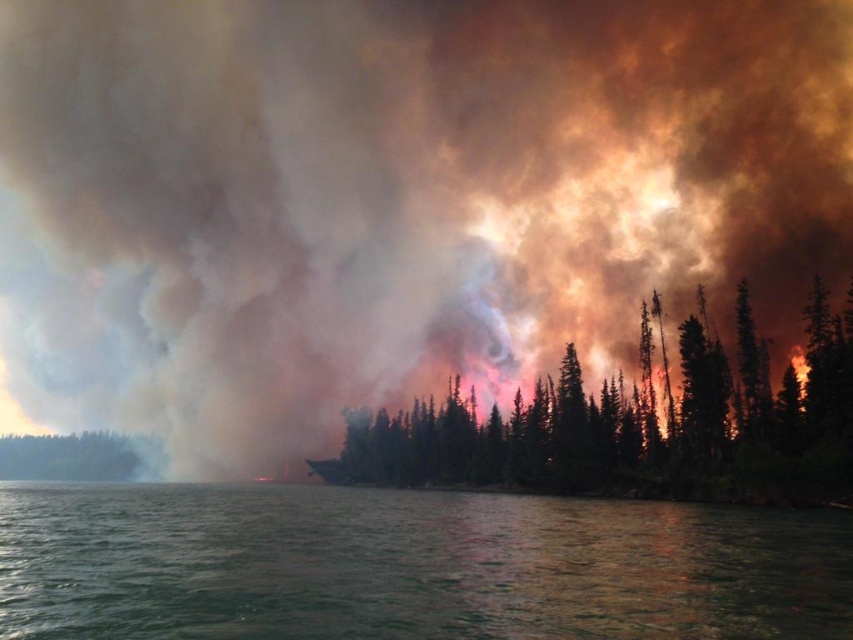
Which is above, green leafy trees at center or green matte tree at left?

green leafy trees at center is above.

Can you confirm if green leafy trees at center is positioned to the left of green matte tree at left?

In fact, green leafy trees at center is to the right of green matte tree at left.

You are a GUI agent. You are given a task and a screenshot of the screen. Output one action in this format:
    pyautogui.click(x=<x>, y=<y>)
    Task: Click on the green leafy trees at center
    The height and width of the screenshot is (640, 853).
    Given the screenshot: What is the action you would take?
    pyautogui.click(x=637, y=428)

At what (x,y) coordinates should I click in order to perform the action: click on green leafy trees at center. Please return your answer as a coordinate pair (x, y). This screenshot has height=640, width=853. Looking at the image, I should click on (637, 428).

Image resolution: width=853 pixels, height=640 pixels. I want to click on green water at lower center, so click(x=409, y=564).

Is green water at lower center above green leafy trees at center?

Indeed, green water at lower center is positioned over green leafy trees at center.

Where is `green water at lower center`? The image size is (853, 640). green water at lower center is located at coordinates (409, 564).

Identify the location of green water at lower center. The image size is (853, 640). [x=409, y=564].

Can you confirm if green water at lower center is thinner than green matte tree at left?

In fact, green water at lower center might be wider than green matte tree at left.

Is green water at lower center to the right of green matte tree at left from the viewer's perspective?

Correct, you'll find green water at lower center to the right of green matte tree at left.

Between point (508, 586) and point (44, 467), which one is positioned in front?

Positioned in front is point (508, 586).

Locate an element on the screen. This screenshot has height=640, width=853. green water at lower center is located at coordinates (409, 564).